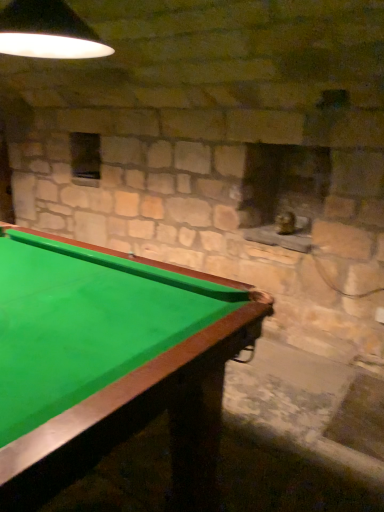
The height and width of the screenshot is (512, 384). I want to click on green felt billiard table at lower left, so click(110, 362).

Describe the element at coordinates (110, 362) in the screenshot. I see `green felt billiard table at lower left` at that location.

The image size is (384, 512). What are the coordinates of `green felt billiard table at lower left` in the screenshot? It's located at (110, 362).